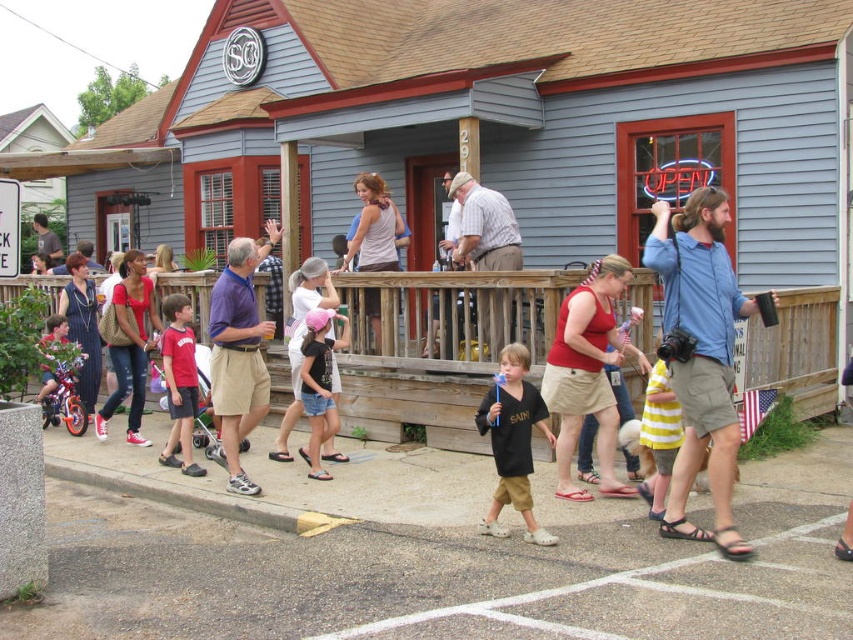
You are standing at the entrance of the building with the gray exterior and red trim. You need to locate the point at coordinates point [436,358]. According to the scene description, where exactly is this point located?

The point [436,358] is located on the wooden at center, which is part of the entrance porch with a railing where several people are gathered.

You are a photographer standing in front of the building. You want to take a photo that includes both the wooden at center and the matte brown tank top at upper center. Which object should you focus on first to ensure both are in frame?

You should focus on the matte brown tank top at upper center first because it is larger than the wooden at center, making it easier to frame both objects in the photo.